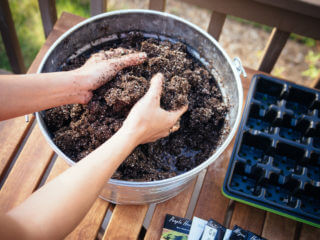
Find the location of a particular element. wood table is located at coordinates (131, 225).